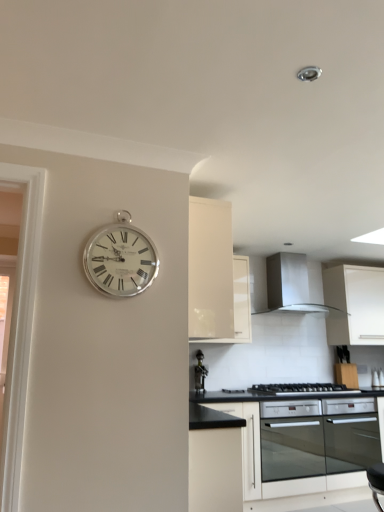
Question: In terms of width, does metallic wine rack at center look wider or thinner when compared to black glass oven at lower center?

Choices:
 (A) wide
 (B) thin

Answer: (B)

Question: Considering the positions of point (200, 352) and point (297, 486), is point (200, 352) closer or farther from the camera than point (297, 486)?

Choices:
 (A) closer
 (B) farther

Answer: (B)

Question: Which object is the farthest from the black matte gas stove at lower center?

Choices:
 (A) black matte cabinet at center, arranged as the 2th cabinetry when viewed from the left
 (B) white matte cabinet at right, the 1th cabinetry when ordered from right to left
 (C) black glass oven at lower center
 (D) satin silver exhaust hood at upper center
 (E) silver metallic clock at upper left

Answer: (E)

Question: Estimate the real-world distances between objects in this image. Which object is farther from the white matte cabinet at right, the 1th cabinetry when ordered from back to front?

Choices:
 (A) metallic wine rack at center
 (B) black matte gas stove at lower center
 (C) white glossy cabinet at upper center, placed as the 1th cabinetry when sorted from left to right
 (D) black glass oven at lower center
 (E) satin silver exhaust hood at upper center

Answer: (C)